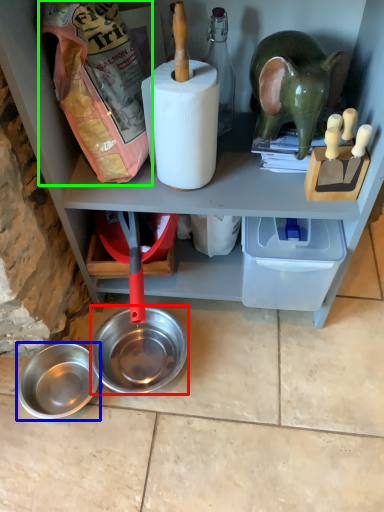
Question: Considering the real-world distances, which object is farthest from bowl (highlighted by a red box)? bowl (highlighted by a blue box) or stuff (highlighted by a green box)?

Choices:
 (A) bowl
 (B) stuff

Answer: (B)